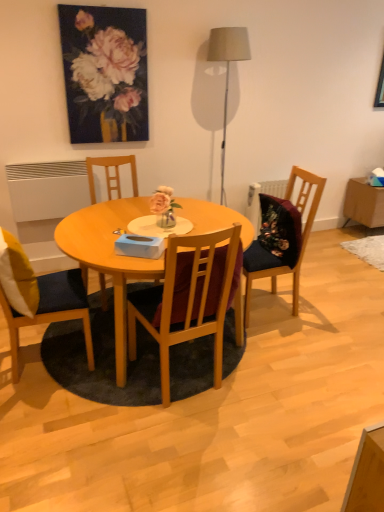
This screenshot has width=384, height=512. Find the location of `vacant area that is in front of wooden chair at left, the 1th chair positioned from the left`. vacant area that is in front of wooden chair at left, the 1th chair positioned from the left is located at coordinates (41, 410).